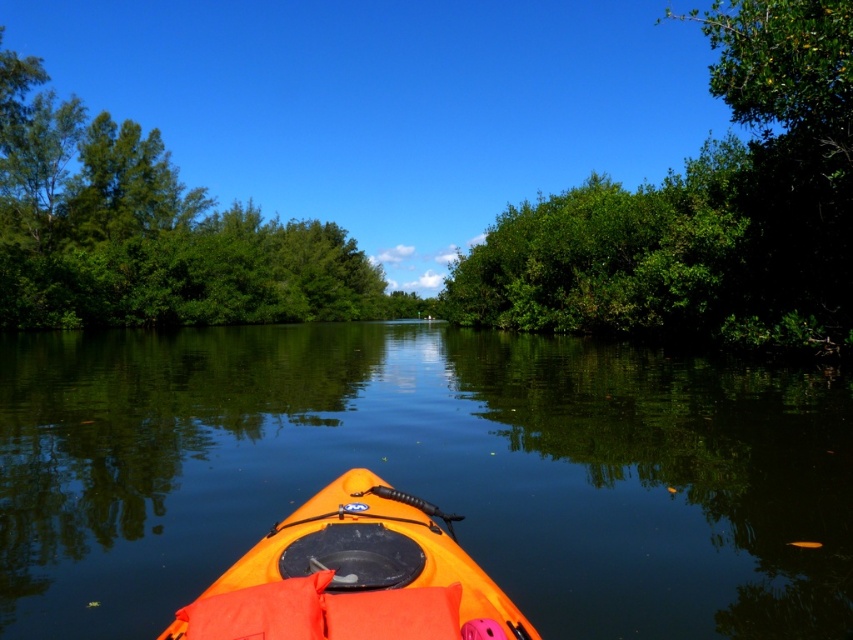
Can you confirm if green leafy trees at left is shorter than orange matte kayak at center?

Incorrect, green leafy trees at left's height does not fall short of orange matte kayak at center's.

Which is behind, point (207, 268) or point (351, 595)?

The point (207, 268) is behind.

I want to click on green leafy trees at left, so click(148, 232).

Who is taller, green leafy tree at right or green leafy trees at left?

green leafy tree at right is taller.

Which is behind, point (618, 292) or point (277, 275)?

The point (277, 275) is more distant.

You are a GUI agent. You are given a task and a screenshot of the screen. Output one action in this format:
    pyautogui.click(x=<x>, y=<y>)
    Task: Click on the green leafy tree at right
    This screenshot has height=640, width=853.
    Given the screenshot: What is the action you would take?
    pyautogui.click(x=703, y=211)

Is orange kayak at center thinner than orange matte kayak at center?

No.

In the scene shown: Is orange kayak at center behind orange matte kayak at center?

Yes, it is.

This screenshot has height=640, width=853. Find the location of `orange kayak at center`. orange kayak at center is located at coordinates (425, 472).

The image size is (853, 640). I want to click on orange kayak at center, so click(x=425, y=472).